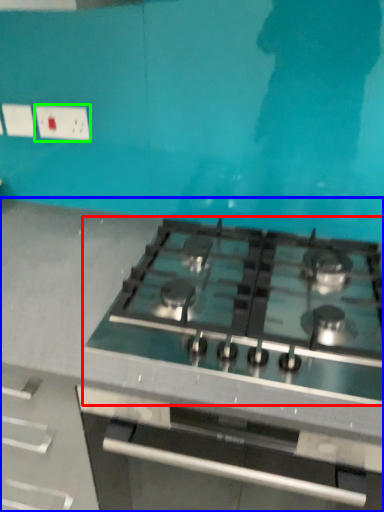
Question: Which object is the closest to the gas stove (highlighted by a red box)? Choose among these: countertop (highlighted by a blue box) or electric outlet (highlighted by a green box).

Choices:
 (A) countertop
 (B) electric outlet

Answer: (A)